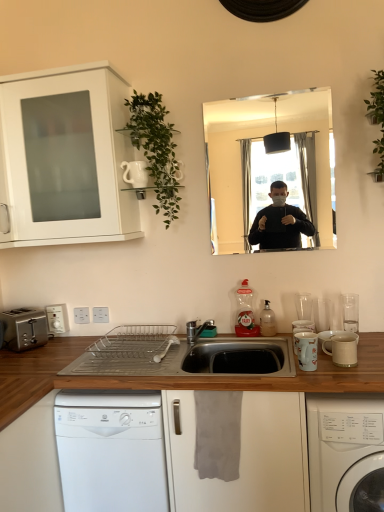
Question: Does green leafy plant at upper left contain translucent plastic soap dispenser at sink, which is the 2th bottle from left to right?

Choices:
 (A) no
 (B) yes

Answer: (A)

Question: Considering the relative sizes of green leafy plant at upper left and translucent plastic soap dispenser at sink, which is the 2th bottle from left to right, in the image provided, is green leafy plant at upper left smaller than translucent plastic soap dispenser at sink, which is the 2th bottle from left to right,?

Choices:
 (A) yes
 (B) no

Answer: (B)

Question: From the image's perspective, is green leafy plant at upper left over translucent plastic soap dispenser at sink, which is counted as the 1th bottle, starting from the right?

Choices:
 (A) yes
 (B) no

Answer: (A)

Question: Is the depth of green leafy plant at upper left less than that of translucent plastic soap dispenser at sink, which is the 2th bottle from left to right?

Choices:
 (A) no
 (B) yes

Answer: (B)

Question: Can you confirm if green leafy plant at upper left is positioned to the left of translucent plastic soap dispenser at sink, which is counted as the 1th bottle, starting from the right?

Choices:
 (A) no
 (B) yes

Answer: (B)

Question: From a real-world perspective, does green leafy plant at upper left stand above translucent plastic soap dispenser at sink, which is counted as the 1th bottle, starting from the right?

Choices:
 (A) no
 (B) yes

Answer: (B)

Question: Is green leafy plant at upper right facing away from silver metallic toaster at lower left?

Choices:
 (A) yes
 (B) no

Answer: (B)

Question: Is green leafy plant at upper right oriented towards silver metallic toaster at lower left?

Choices:
 (A) no
 (B) yes

Answer: (A)

Question: From a real-world perspective, is green leafy plant at upper right over silver metallic toaster at lower left?

Choices:
 (A) yes
 (B) no

Answer: (A)

Question: Can you confirm if green leafy plant at upper right is shorter than silver metallic toaster at lower left?

Choices:
 (A) yes
 (B) no

Answer: (B)

Question: Can you confirm if green leafy plant at upper right is positioned to the right of silver metallic toaster at lower left?

Choices:
 (A) no
 (B) yes

Answer: (B)

Question: Can you confirm if green leafy plant at upper right is smaller than silver metallic toaster at lower left?

Choices:
 (A) no
 (B) yes

Answer: (A)

Question: Is silver metallic toaster at lower left thinner than white glossy mug at right, arranged as the second appliance when viewed from the top?

Choices:
 (A) yes
 (B) no

Answer: (B)